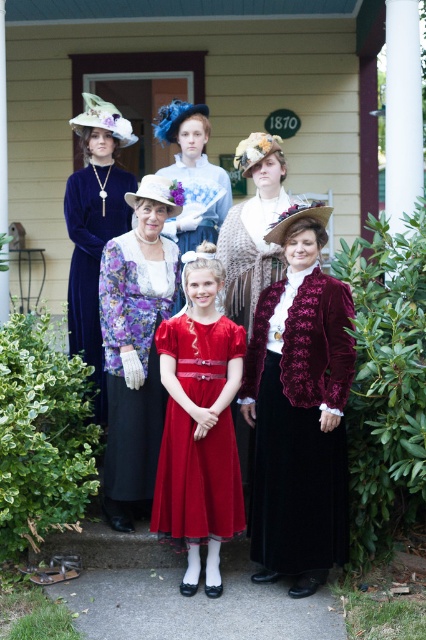
You are a photographer planning to take a group photo of the velvet maroon jacket at center and the shiny red dress at center. Which clothing item has a larger width to accommodate more accessories?

The velvet maroon jacket at center has a larger width than the shiny red dress at center, so it can accommodate more accessories.

You are standing on the porch of the house and want to place a small potted plant between the two points marked as point [333,406] and point [157,412]. Which point should you stand closer to in order to place the plant exactly halfway between them?

To place the plant exactly halfway between point [333,406] and point [157,412], you should stand closer to point [333,406] since it is closer to the viewer than point [157,412].

What are the coordinates of the shiny red dress at center?

The shiny red dress at center is located at coordinates point (x=196, y=481).